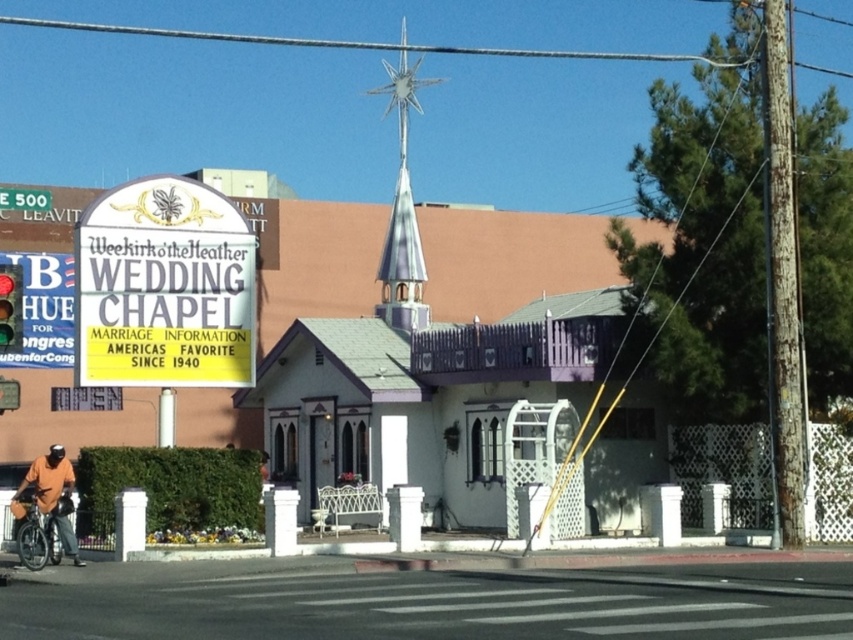
You are a delivery person who needs to park your 2.5 meter long silver metallic bicycle at lower left near the red glass traffic light at upper left. Is there enough space between them to park the bicycle without blocking the traffic light?

The distance between the silver metallic bicycle at lower left and the red glass traffic light at upper left is 3.66 meters. Since the bicycle is 2.5 meters long, there is sufficient space to park it without blocking the traffic light.

You are planning to park your silver metallic bicycle at lower left next to the red glass traffic light at upper left. Considering their sizes, will the bicycle fit in the space next to the traffic light without overlapping?

The silver metallic bicycle at lower left is narrower than the red glass traffic light at upper left. Since the bicycle is narrower, it should fit next to the traffic light without overlapping.

You are standing at the entrance of the chapel and want to walk towards the point labeled as point (117, 371). Which direction should you go relative to the point labeled as point (405, 125)?

Since point (117, 371) is in front of point (405, 125), you should walk towards the direction facing away from point (405, 125) to reach point (117, 371).